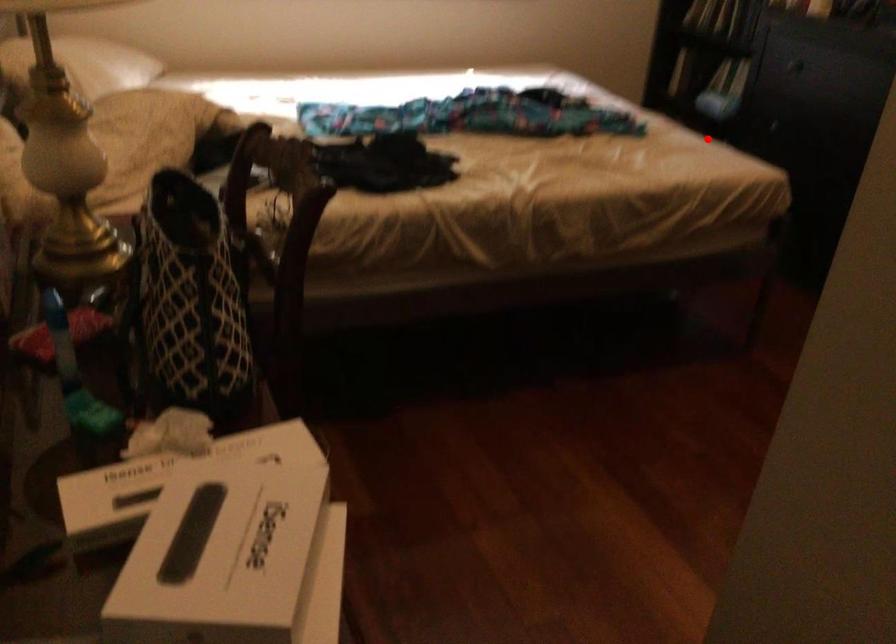
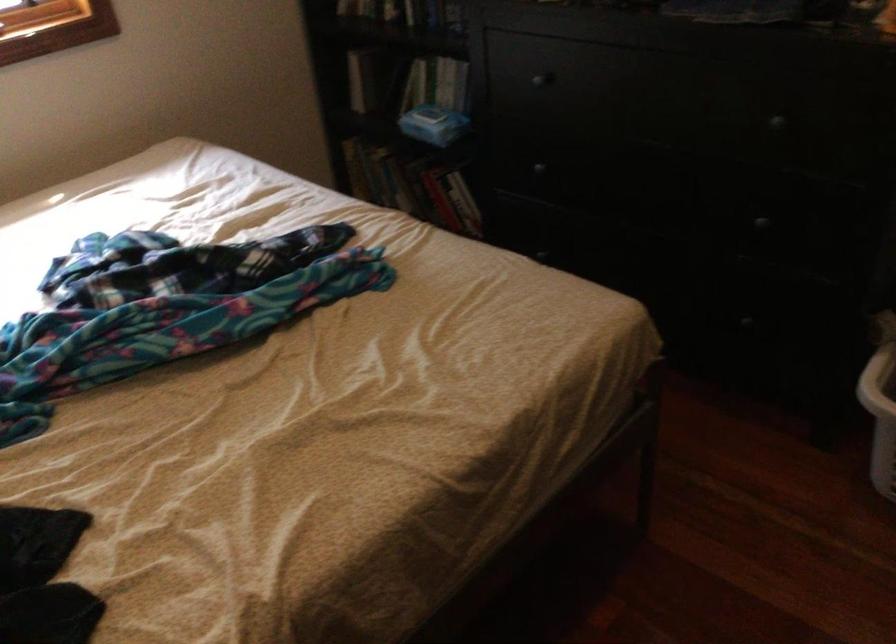
Find the pixel in the second image that matches the highlighted location in the first image.

(418, 187)